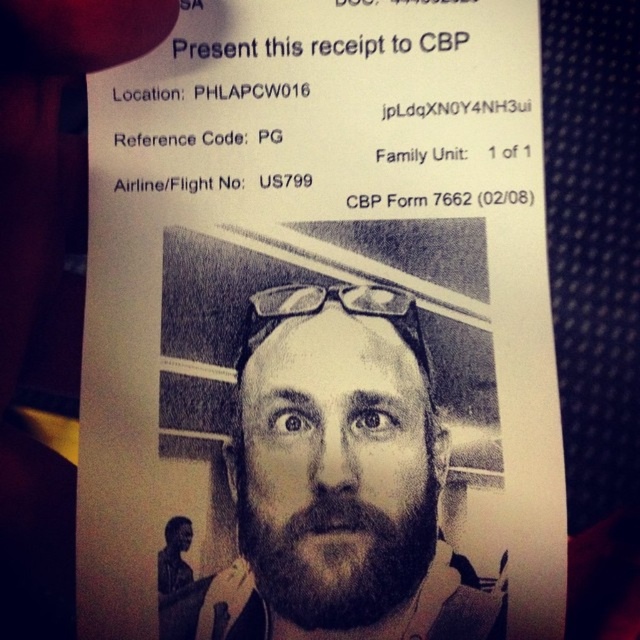
Based on the provided CBP Form 7662, where is the beige textured beard at center positioned in relation to the photograph?

The beige textured beard at center is located at point coordinates 0.750 on the x axis and 0.533 on the y axis.

You are a border agent reviewing a CBP Form 7662. The form has two beards described as beige textured beard at center and dark brown thick beard at center. Which of these beards is wider?

The beige textured beard at center is wider than the dark brown thick beard at center according to the form details.